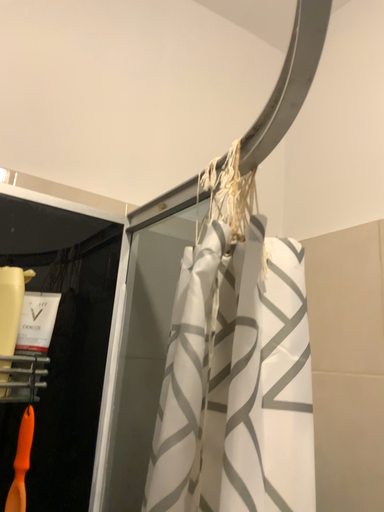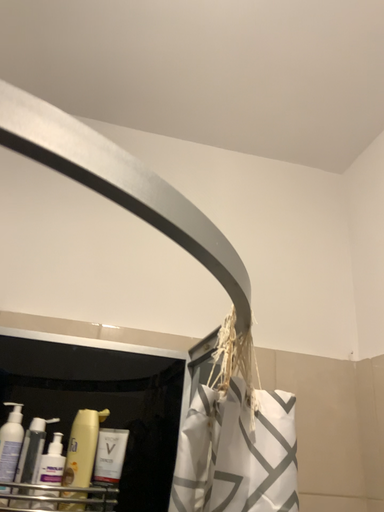
Question: How did the camera likely rotate when shooting the video?

Choices:
 (A) rotated right
 (B) rotated left

Answer: (B)